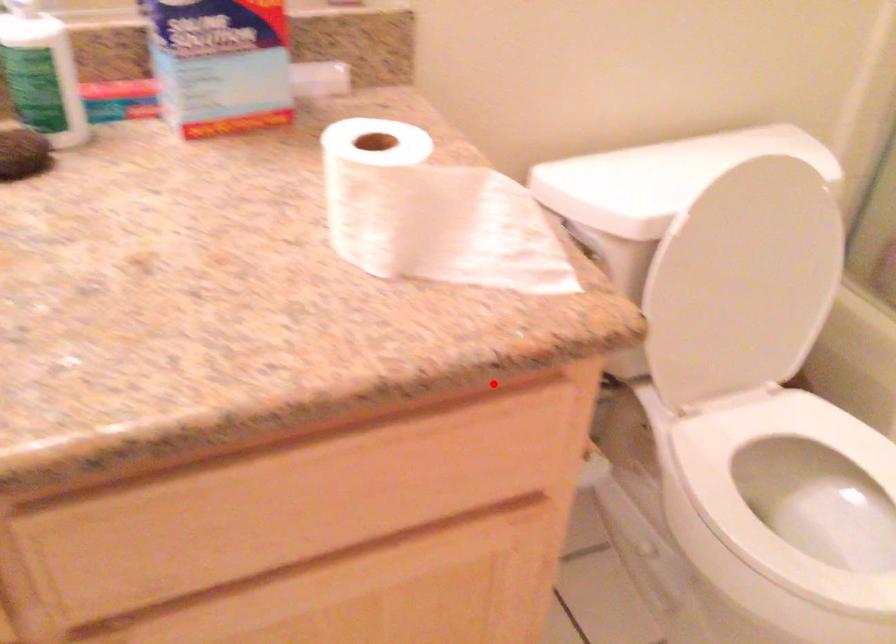
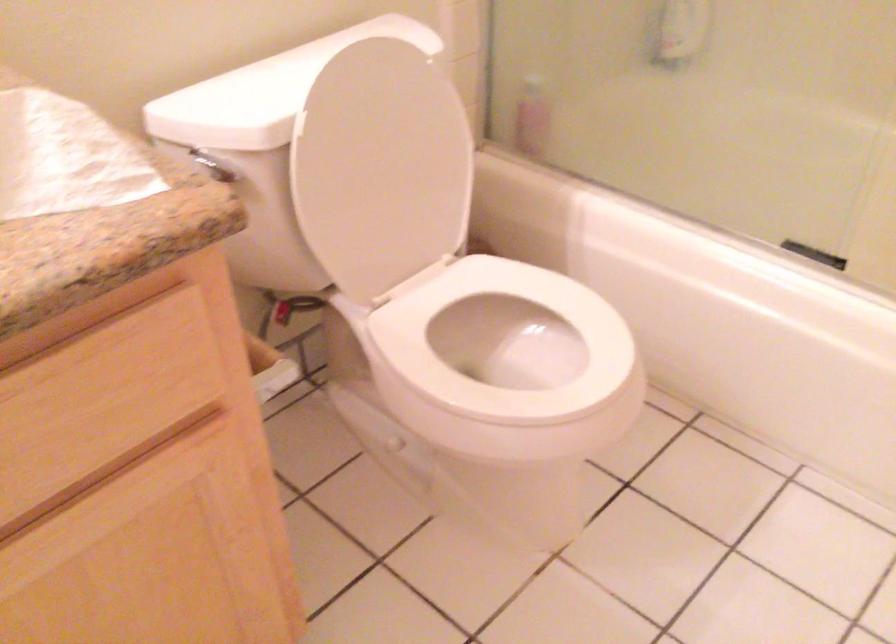
Locate, in the second image, the point that corresponds to the highlighted location in the first image.

(117, 303)